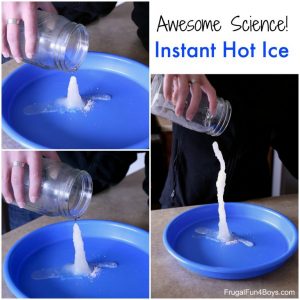
Locate an element on the screen. This screenshot has height=300, width=300. glass jar is located at coordinates (57, 184), (45, 40), (199, 115).